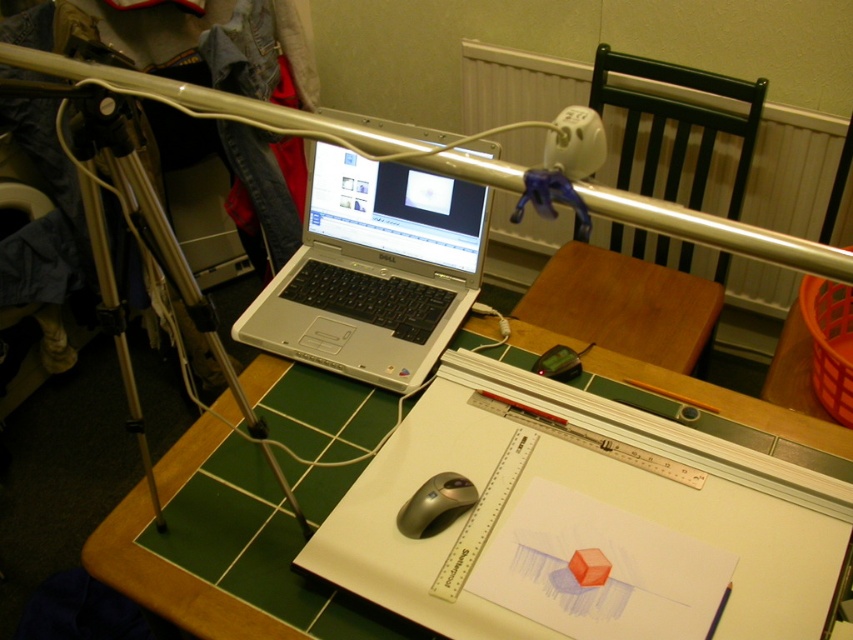
You are trying to place a small plant pot on the desk. The plant pot requires a spot that is not covered by any objects. According to the image, is the area at point coordinates (170,580) suitable for placing the plant pot?

The area at point coordinates (170,580) is covered by the green tile table at center, so placing the plant pot there would not be suitable.

You are setting up a desk organizer and need to place a divider between the silver metallic laptop at center and the silver metallic mouse at center. Since the laptop is larger, where should the divider be placed to ensure both items have enough space?

The divider should be placed closer to the silver metallic mouse at center since the silver metallic laptop at center is larger and requires more space.